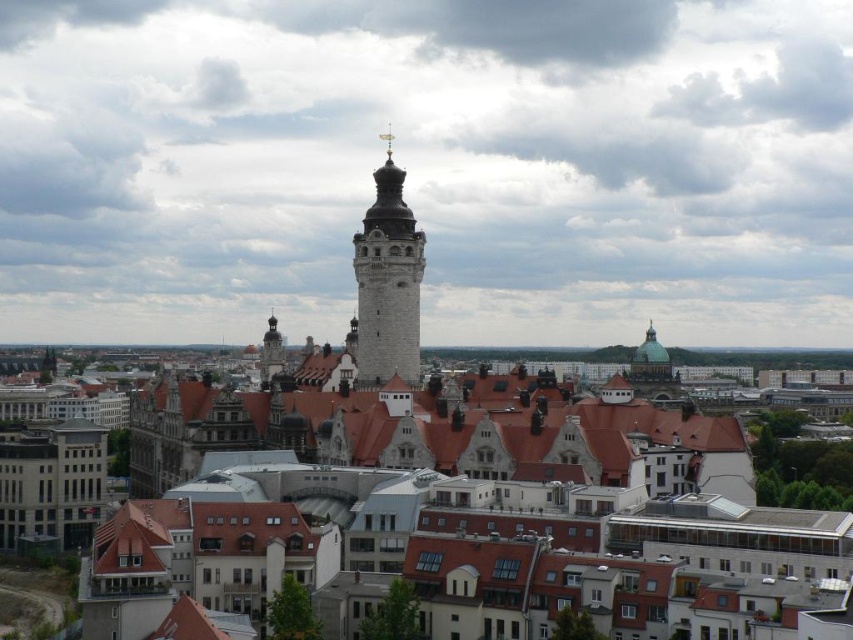
Is matte stone tower at center thinner than white stone tower at center?

No.

Is matte stone tower at center positioned in front of white stone tower at center?

Yes.

Measure the distance between point (265, 392) and camera.

They are 646.18 feet apart.

Find the location of `matte stone tower at center`. matte stone tower at center is located at coordinates (453, 429).